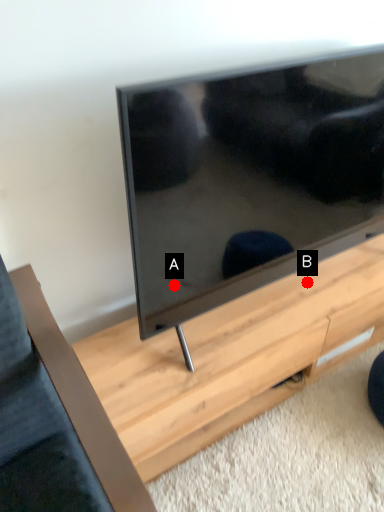
Question: Two points are circled on the image, labeled by A and B beside each circle. Which point is closer to the camera?

Choices:
 (A) A is closer
 (B) B is closer

Answer: (A)